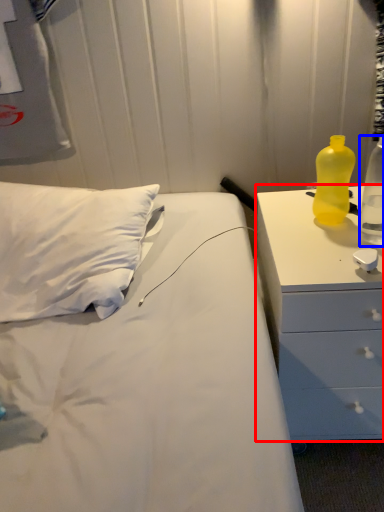
Question: Which object is further to the camera taking this photo, chest of drawers (highlighted by a red box) or bottle (highlighted by a blue box)?

Choices:
 (A) chest of drawers
 (B) bottle

Answer: (B)